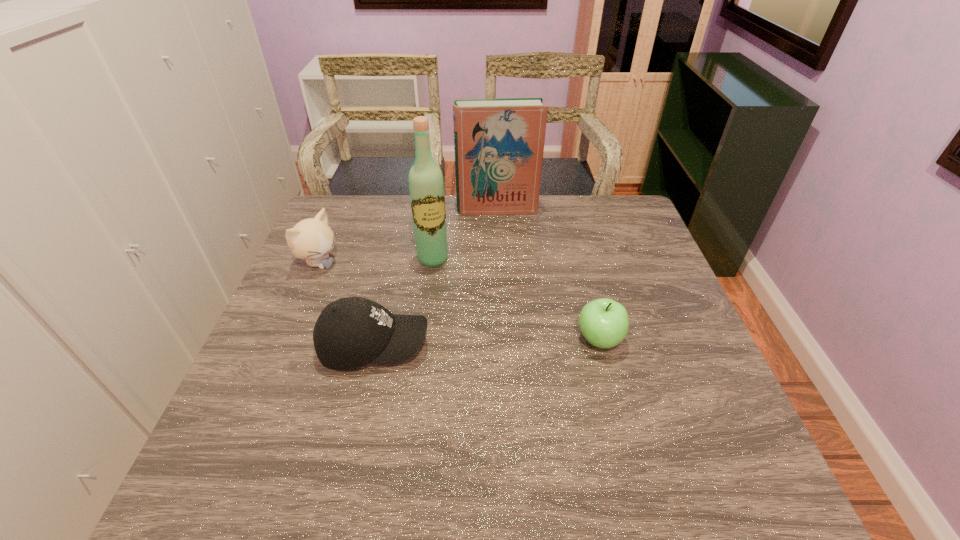
At what (x,y) coordinates should I click in order to perform the action: click on kitten that is positioned at the left edge. Please return your answer as a coordinate pair (x, y). The image size is (960, 540). Looking at the image, I should click on (312, 239).

This screenshot has height=540, width=960. What are the coordinates of `free space at the far edge of the desktop` in the screenshot? It's located at (449, 225).

The height and width of the screenshot is (540, 960). I want to click on free spot at the near edge of the desktop, so click(x=642, y=407).

At what (x,y) coordinates should I click in order to perform the action: click on free space at the left edge of the desktop. Please return your answer as a coordinate pair (x, y). Looking at the image, I should click on (300, 321).

Identify the location of free space at the right edge of the desktop. (622, 258).

What are the coordinates of `vacant region at the far right corner` in the screenshot? It's located at [595, 230].

You are a GUI agent. You are given a task and a screenshot of the screen. Output one action in this format:
    pyautogui.click(x=<x>, y=<y>)
    Task: Click on the empty space that is in between the second object from right to left and the leftmost object
    This screenshot has height=540, width=960.
    Given the screenshot: What is the action you would take?
    pyautogui.click(x=408, y=236)

You are a GUI agent. You are given a task and a screenshot of the screen. Output one action in this format:
    pyautogui.click(x=<x>, y=<y>)
    Task: Click on the free point between the wine bottle and the baseball cap
    
    Given the screenshot: What is the action you would take?
    pyautogui.click(x=403, y=302)

At what (x,y) coordinates should I click in order to perform the action: click on vacant area that lies between the wine bottle and the kitten. Please return your answer as a coordinate pair (x, y). This screenshot has height=540, width=960. Looking at the image, I should click on (376, 261).

Locate an element on the screen. This screenshot has height=540, width=960. vacant area between the wine bottle and the kitten is located at coordinates (376, 261).